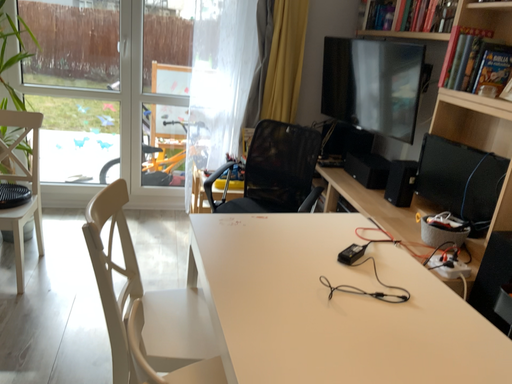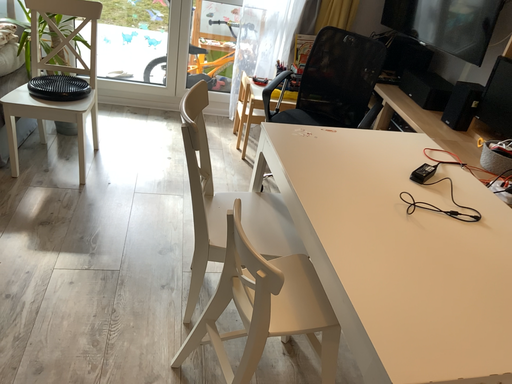
Question: Which way did the camera rotate in the video?

Choices:
 (A) rotated upward
 (B) rotated downward

Answer: (B)